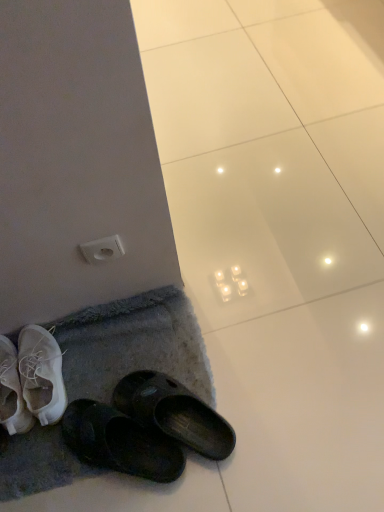
Question: Could white plastic outlet at upper left be considered to be inside gray textured bath mat at lower left?

Choices:
 (A) no
 (B) yes

Answer: (A)

Question: Does gray textured bath mat at lower left have a smaller size compared to white plastic outlet at upper left?

Choices:
 (A) yes
 (B) no

Answer: (B)

Question: Does gray textured bath mat at lower left touch white plastic outlet at upper left?

Choices:
 (A) no
 (B) yes

Answer: (A)

Question: Does gray textured bath mat at lower left have a lesser height compared to white plastic outlet at upper left?

Choices:
 (A) no
 (B) yes

Answer: (B)

Question: Does gray textured bath mat at lower left turn towards white plastic outlet at upper left?

Choices:
 (A) yes
 (B) no

Answer: (B)

Question: Does gray textured bath mat at lower left have a greater width compared to white plastic outlet at upper left?

Choices:
 (A) no
 (B) yes

Answer: (B)

Question: Is white plastic outlet at upper left at the right side of gray textured bath mat at lower left?

Choices:
 (A) no
 (B) yes

Answer: (B)

Question: Can you confirm if white plastic outlet at upper left is smaller than gray textured bath mat at lower left?

Choices:
 (A) no
 (B) yes

Answer: (B)

Question: Is white plastic outlet at upper left surrounding gray textured bath mat at lower left?

Choices:
 (A) yes
 (B) no

Answer: (B)

Question: Is white plastic outlet at upper left further to camera compared to gray textured bath mat at lower left?

Choices:
 (A) yes
 (B) no

Answer: (B)

Question: Are white plastic outlet at upper left and gray textured bath mat at lower left located far from each other?

Choices:
 (A) yes
 (B) no

Answer: (B)

Question: Can we say white plastic outlet at upper left lies outside gray textured bath mat at lower left?

Choices:
 (A) no
 (B) yes

Answer: (B)

Question: Relative to gray textured bath mat at lower left, is white plastic outlet at upper left in front or behind?

Choices:
 (A) front
 (B) behind

Answer: (A)